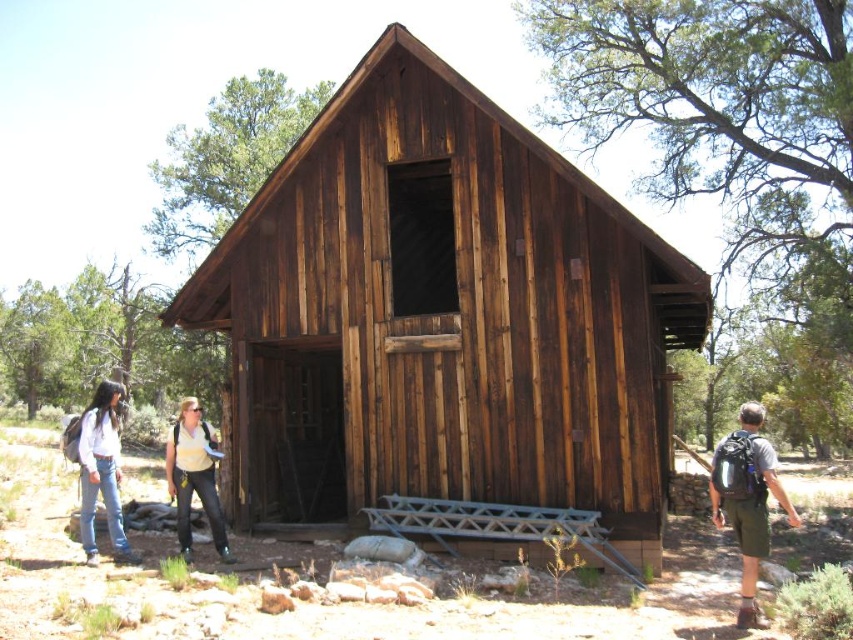
Question: Which point is farther to the camera?

Choices:
 (A) matte yellow shirt at center
 (B) denim pants at lower left
 (C) denim jeans at lower left
 (D) matte gray backpack at right

Answer: (A)

Question: Is brown wooden cabin at center smaller than denim jeans at lower left?

Choices:
 (A) yes
 (B) no

Answer: (A)

Question: Can you confirm if matte gray backpack at right is bigger than matte yellow shirt at center?

Choices:
 (A) yes
 (B) no

Answer: (A)

Question: Which is nearer to the matte gray backpack at right?

Choices:
 (A) denim jeans at lower left
 (B) brown wooden cabin at center

Answer: (B)

Question: Is brown wooden cabin at center thinner than denim jeans at lower left?

Choices:
 (A) yes
 (B) no

Answer: (A)

Question: Which of the following is the farthest from the observer?

Choices:
 (A) denim jeans at lower left
 (B) matte yellow shirt at center
 (C) matte gray backpack at right

Answer: (B)